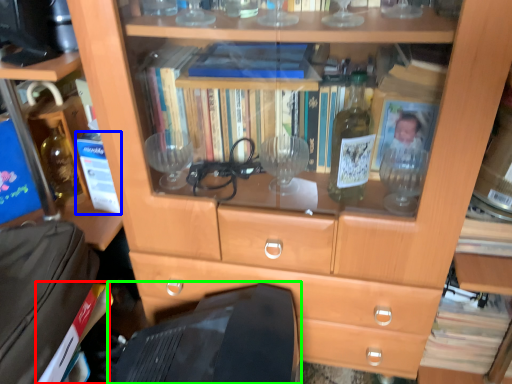
Question: Which object is positioned farthest from paperback book (highlighted by a red box)? Select from paperback book (highlighted by a blue box) and computer monitor (highlighted by a green box).

Choices:
 (A) paperback book
 (B) computer monitor

Answer: (A)